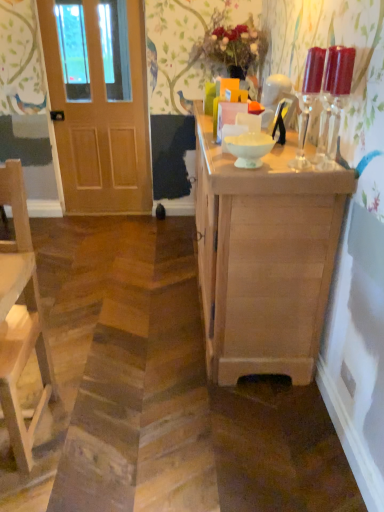
Question: From the image's perspective, is wooden door at left on top of white glossy bowl at center?

Choices:
 (A) no
 (B) yes

Answer: (B)

Question: Considering the relative sizes of wooden door at left and white glossy bowl at center in the image provided, is wooden door at left taller than white glossy bowl at center?

Choices:
 (A) yes
 (B) no

Answer: (A)

Question: Is wooden door at left at the right side of white glossy bowl at center?

Choices:
 (A) yes
 (B) no

Answer: (B)

Question: Is wooden door at left aimed at white glossy bowl at center?

Choices:
 (A) no
 (B) yes

Answer: (B)

Question: Does wooden door at left have a lesser width compared to white glossy bowl at center?

Choices:
 (A) no
 (B) yes

Answer: (B)

Question: Looking at their shapes, would you say white glossy bowl at center is wider or thinner than natural wood cabinet at center?

Choices:
 (A) wide
 (B) thin

Answer: (B)

Question: Based on their sizes in the image, would you say white glossy bowl at center is bigger or smaller than natural wood cabinet at center?

Choices:
 (A) big
 (B) small

Answer: (B)

Question: From the image's perspective, is white glossy bowl at center above or below natural wood cabinet at center?

Choices:
 (A) above
 (B) below

Answer: (A)

Question: Relative to natural wood cabinet at center, is white glossy bowl at center in front or behind?

Choices:
 (A) behind
 (B) front

Answer: (A)

Question: Is translucent glass candle holders at upper right, which appears as the 1th candle holder when viewed from the right, taller or shorter than light brown wooden chair at left?

Choices:
 (A) tall
 (B) short

Answer: (B)

Question: Is translucent glass candle holders at upper right, acting as the second candle holder starting from the left, situated inside light brown wooden chair at left or outside?

Choices:
 (A) outside
 (B) inside

Answer: (A)

Question: Considering the positions of point (332, 95) and point (23, 344), is point (332, 95) closer or farther from the camera than point (23, 344)?

Choices:
 (A) farther
 (B) closer

Answer: (A)

Question: Is translucent glass candle holders at upper right, which appears as the 1th candle holder when viewed from the right, wider or thinner than light brown wooden chair at left?

Choices:
 (A) wide
 (B) thin

Answer: (B)

Question: Based on their sizes in the image, would you say wooden door at left is bigger or smaller than natural wood cabinet at center?

Choices:
 (A) big
 (B) small

Answer: (B)

Question: Do you think wooden door at left is within natural wood cabinet at center, or outside of it?

Choices:
 (A) inside
 (B) outside

Answer: (B)